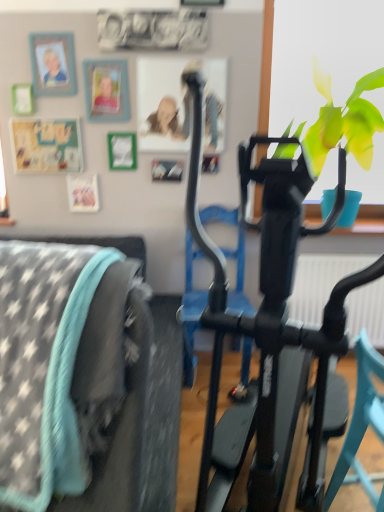
Question: Is black matte stationary bicycle at center not close to teal plastic chair at center?

Choices:
 (A) no
 (B) yes

Answer: (A)

Question: Is black matte stationary bicycle at center closer to the viewer compared to teal plastic chair at center?

Choices:
 (A) no
 (B) yes

Answer: (B)

Question: Is black matte stationary bicycle at center not within teal plastic chair at center?

Choices:
 (A) no
 (B) yes

Answer: (B)

Question: Is black matte stationary bicycle at center looking in the opposite direction of teal plastic chair at center?

Choices:
 (A) no
 (B) yes

Answer: (A)

Question: Does black matte stationary bicycle at center appear on the left side of teal plastic chair at center?

Choices:
 (A) no
 (B) yes

Answer: (B)

Question: From the image's perspective, would you say black matte stationary bicycle at center is positioned over teal plastic chair at center?

Choices:
 (A) no
 (B) yes

Answer: (B)

Question: Is wooden photo frame at upper left, marked as the second picture frame in a right-to-left arrangement, further to camera compared to teal plastic chair at center?

Choices:
 (A) no
 (B) yes

Answer: (B)

Question: Are wooden photo frame at upper left, marked as the second picture frame in a right-to-left arrangement, and teal plastic chair at center making contact?

Choices:
 (A) no
 (B) yes

Answer: (A)

Question: Considering the relative sizes of wooden photo frame at upper left, the 1th picture frame in the left-to-right sequence, and teal plastic chair at center in the image provided, is wooden photo frame at upper left, the 1th picture frame in the left-to-right sequence, thinner than teal plastic chair at center?

Choices:
 (A) yes
 (B) no

Answer: (A)

Question: From a real-world perspective, is wooden photo frame at upper left, marked as the second picture frame in a right-to-left arrangement, on teal plastic chair at center?

Choices:
 (A) no
 (B) yes

Answer: (B)

Question: Is wooden photo frame at upper left, the 1th picture frame in the left-to-right sequence, positioned with its back to teal plastic chair at center?

Choices:
 (A) yes
 (B) no

Answer: (B)

Question: Can you confirm if wooden photo frame at upper left, marked as the second picture frame in a right-to-left arrangement, is wider than teal plastic chair at center?

Choices:
 (A) no
 (B) yes

Answer: (A)

Question: Can you confirm if matte plastic picture frame at upper left, the 2th picture frame positioned from the left, is shorter than black matte stationary bicycle at center?

Choices:
 (A) no
 (B) yes

Answer: (B)